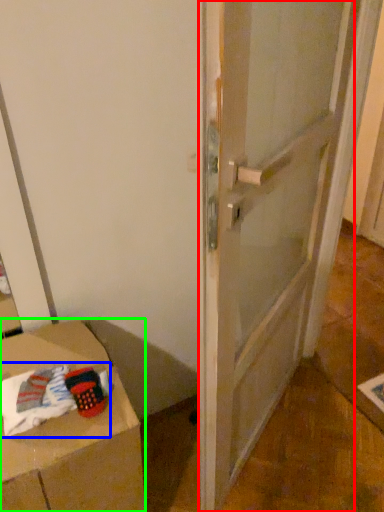
Question: Which object is positioned closest to door (highlighted by a red box)? Select from laundry (highlighted by a blue box) and furniture (highlighted by a green box).

Choices:
 (A) laundry
 (B) furniture

Answer: (B)